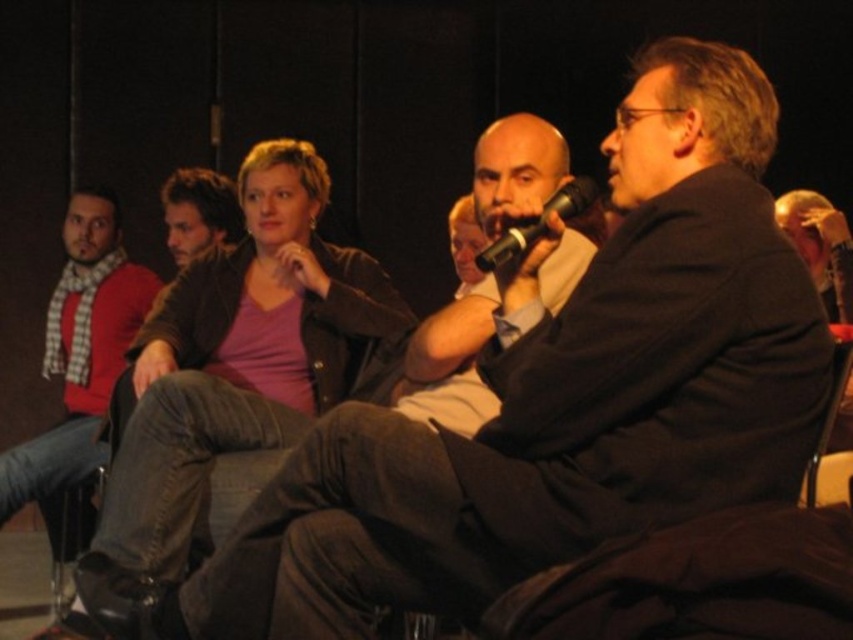
Consider the image. Is pink matte jacket at upper center further to the viewer compared to black matte microphone at center?

Yes, it is behind black matte microphone at center.

Which is more to the right, pink matte jacket at upper center or black matte microphone at center?

From the viewer's perspective, black matte microphone at center appears more on the right side.

You are a GUI agent. You are given a task and a screenshot of the screen. Output one action in this format:
    pyautogui.click(x=<x>, y=<y>)
    Task: Click on the pink matte jacket at upper center
    The image size is (853, 640).
    Given the screenshot: What is the action you would take?
    pyautogui.click(x=241, y=355)

Locate an element on the screen. pink matte jacket at upper center is located at coordinates (241, 355).

Does red checkered scarf at left have a smaller size compared to black matte microphone at center?

No, red checkered scarf at left is not smaller than black matte microphone at center.

Is red checkered scarf at left above black matte microphone at center?

Actually, red checkered scarf at left is below black matte microphone at center.

Is point (57, 484) positioned before point (515, 234)?

That is False.

Identify the location of red checkered scarf at left. The image size is (853, 640). (80, 349).

Which is in front, point (271, 348) or point (94, 396)?

Point (271, 348)

Image resolution: width=853 pixels, height=640 pixels. What do you see at coordinates (241, 355) in the screenshot? I see `pink matte jacket at upper center` at bounding box center [241, 355].

Find the location of a particular element. pink matte jacket at upper center is located at coordinates (241, 355).

Locate an element on the screen. pink matte jacket at upper center is located at coordinates (241, 355).